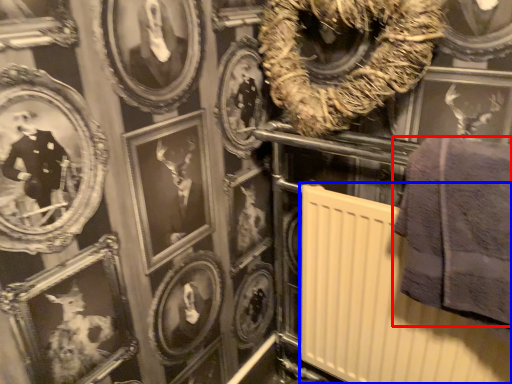
Question: Which point is closer to the camera, towel (highlighted by a red box) or radiator (highlighted by a blue box)?

Choices:
 (A) towel
 (B) radiator

Answer: (A)